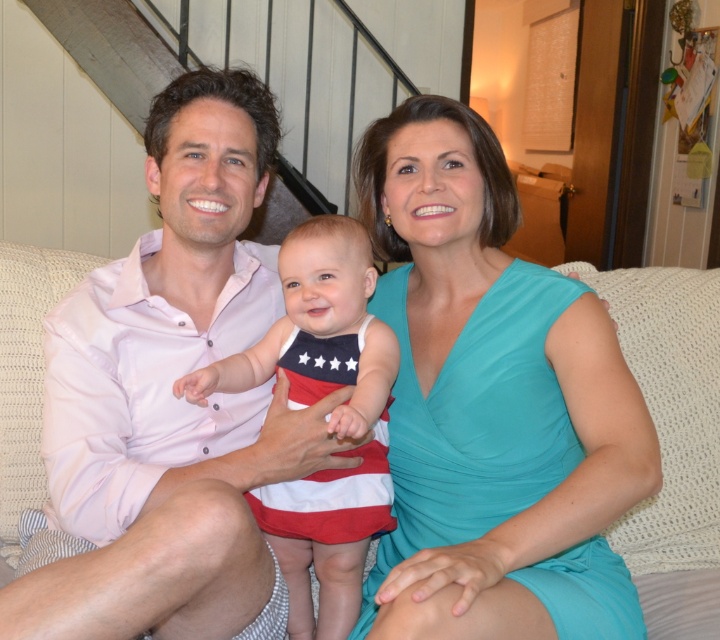
What object is located at the coordinates point (672, 440)?

The point (672, 440) indicates the white woven couch at center.